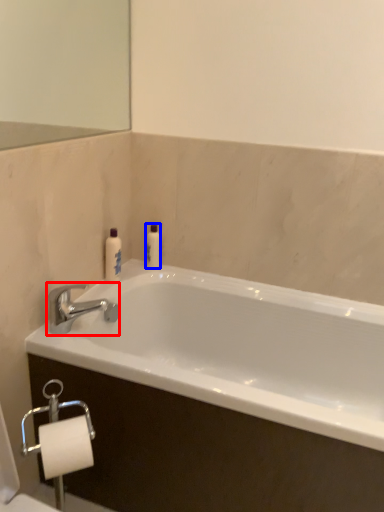
Question: Which object is further to the camera taking this photo, tap (highlighted by a red box) or toiletry (highlighted by a blue box)?

Choices:
 (A) tap
 (B) toiletry

Answer: (B)